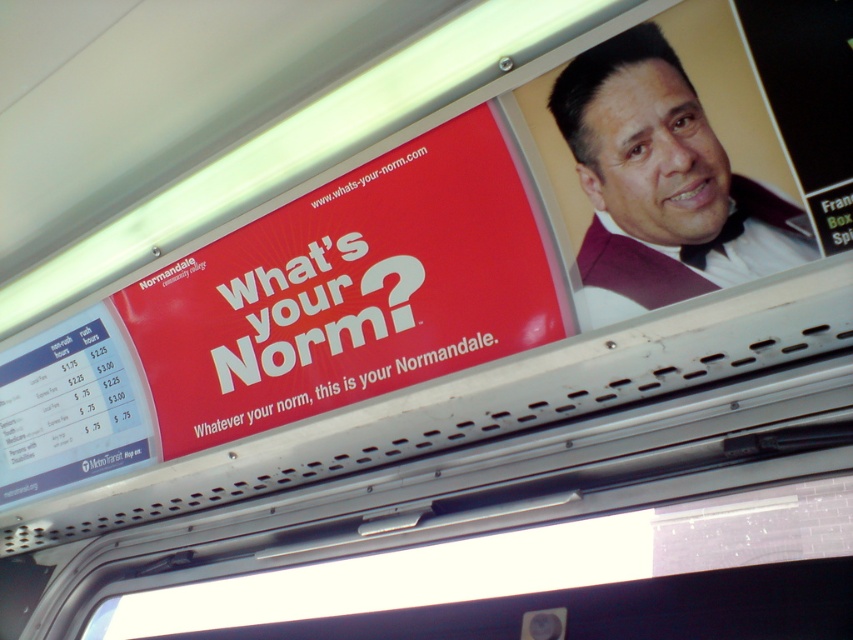
You are a passenger sitting in the front row of the bus and want to read the prices listed on the matte red sign at upper center. Can you see the prices from your seat?

Yes, the prices are listed on the matte red sign at upper center, so you can see them from your seat.

You are a passenger on a bus and you want to read the prices listed on the matte red sign at upper center and the maroon textured vest at upper right. Which object is closer to the left side of the bus ceiling?

The matte red sign at upper center is positioned on the left side of maroon textured vest at upper right, so it is closer to the left side of the bus ceiling.

You are standing inside a bus and looking at the promotional advertisement on the ceiling. There is a point at coordinates point [480,312]. If you want to touch this point with a stick that is 1.8 meters long, will the stick be long enough?

The distance between point [480,312] and the viewer is 2.00 meters. Since the stick is only 1.8 meters long, it is not long enough to reach the point.